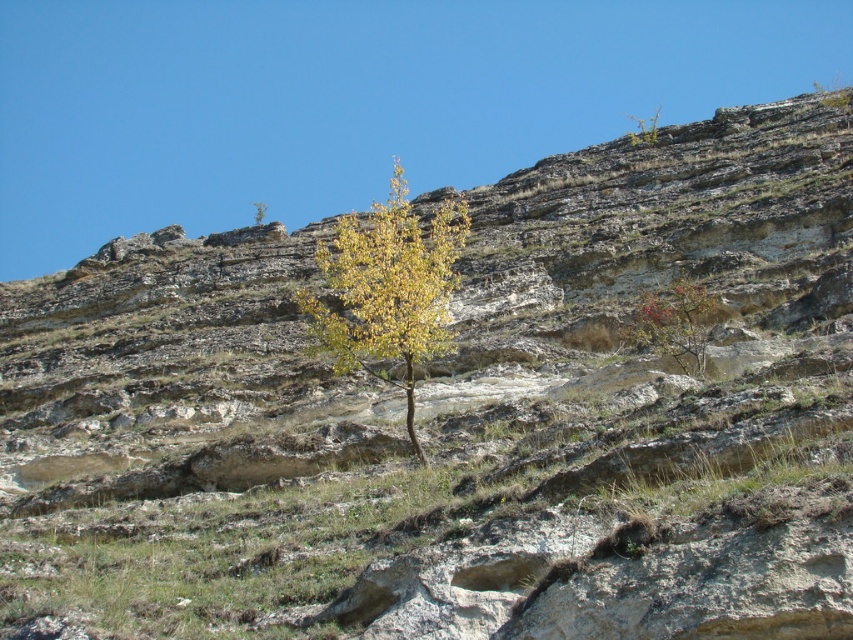
Question: Which of the following is the farthest from the observer?

Choices:
 (A) (412, 314)
 (B) (672, 291)

Answer: (B)

Question: Can you confirm if yellow-green foliage at center is positioned below reddish-brown bark tree at right?

Choices:
 (A) no
 (B) yes

Answer: (A)

Question: Does yellow-green foliage at center appear under reddish-brown bark tree at right?

Choices:
 (A) yes
 (B) no

Answer: (B)

Question: Is yellow-green foliage at center thinner than reddish-brown bark tree at right?

Choices:
 (A) yes
 (B) no

Answer: (B)